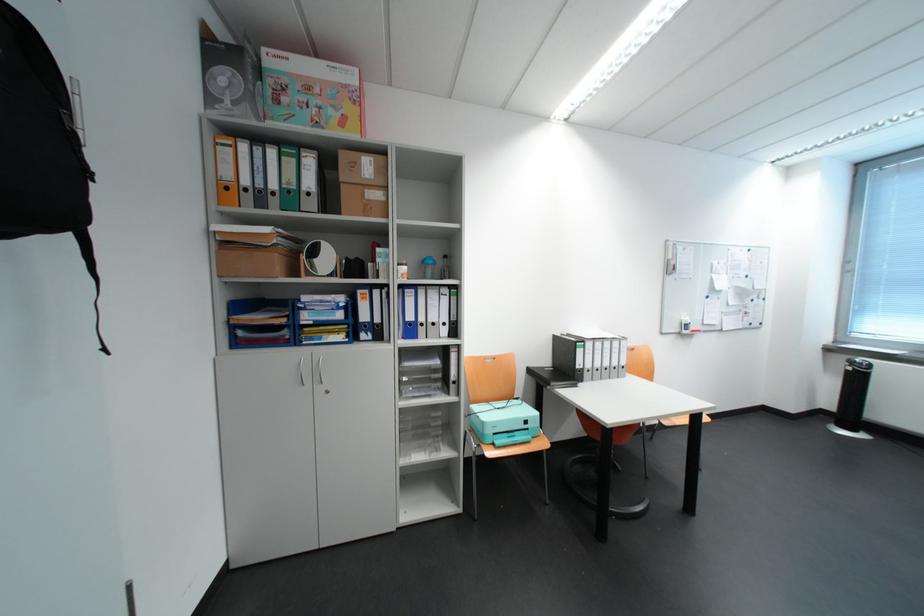
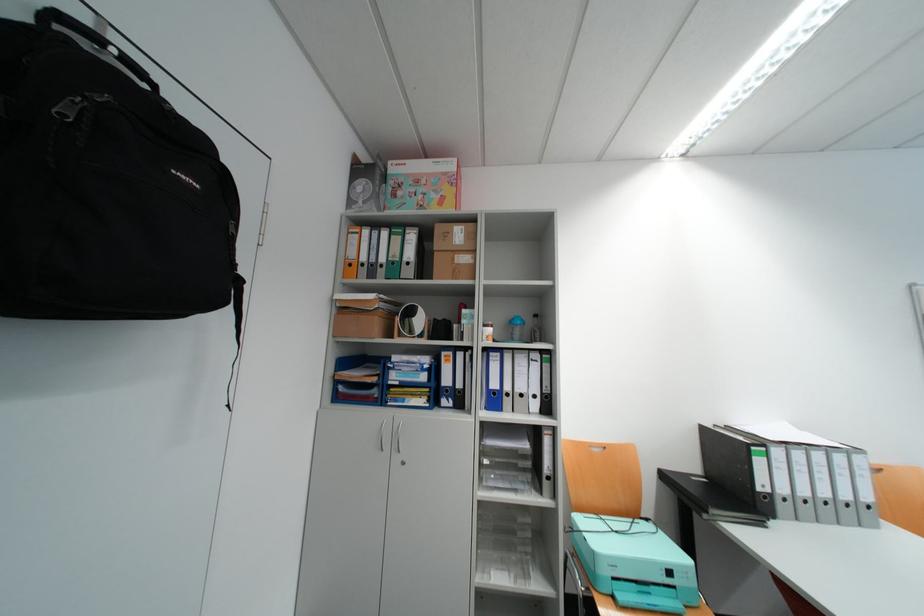
Where in the second image is the point corresponding to pixel 415 463 from the first image?

(491, 581)